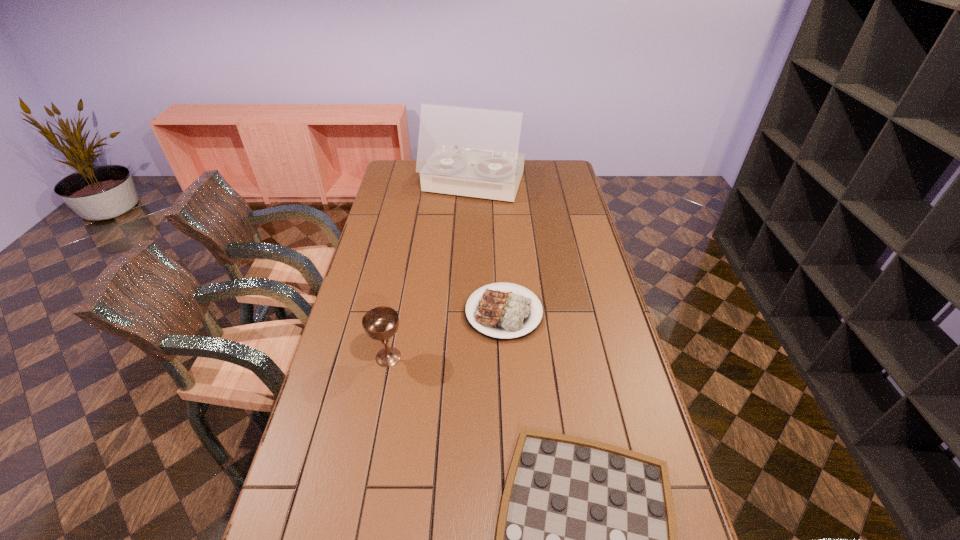
Select which object is the third closest to the checkerboard. Please provide its 2D coordinates. Your answer should be formatted as a tuple, i.e. [(x, y)], where the tuple contains the x and y coordinates of a point satisfying the conditions above.

[(465, 151)]

Locate an element on the screen. free spot that satisfies the following two spatial constraints: 1. on the back side of the plate; 2. on the right side of the chalice is located at coordinates (396, 313).